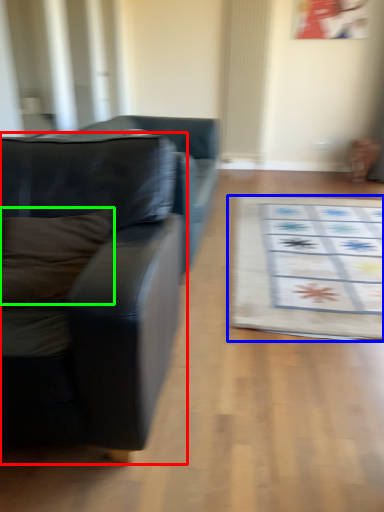
Question: Considering the real-world distances, which object is farthest from studio couch (highlighted by a red box)? mat (highlighted by a blue box) or pillow (highlighted by a green box)?

Choices:
 (A) mat
 (B) pillow

Answer: (A)